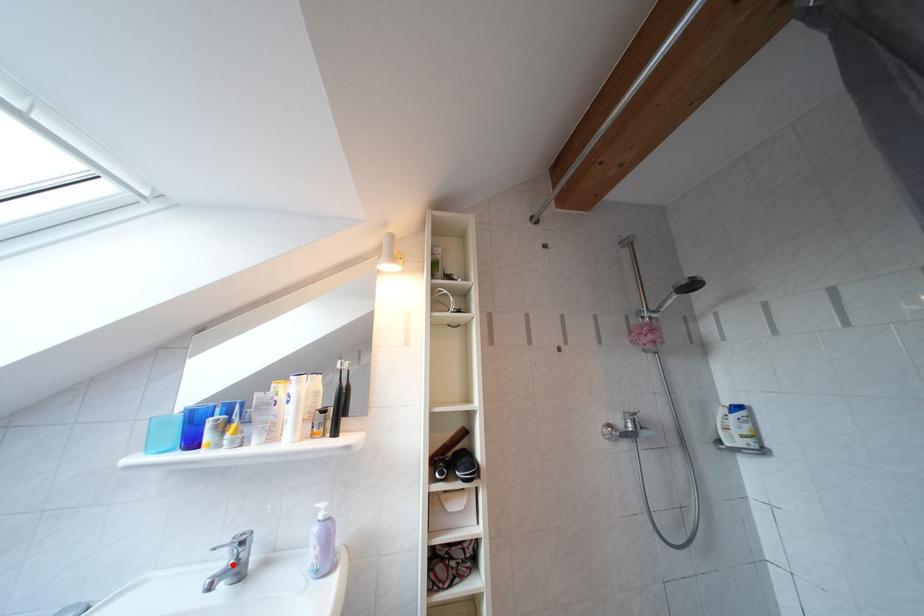
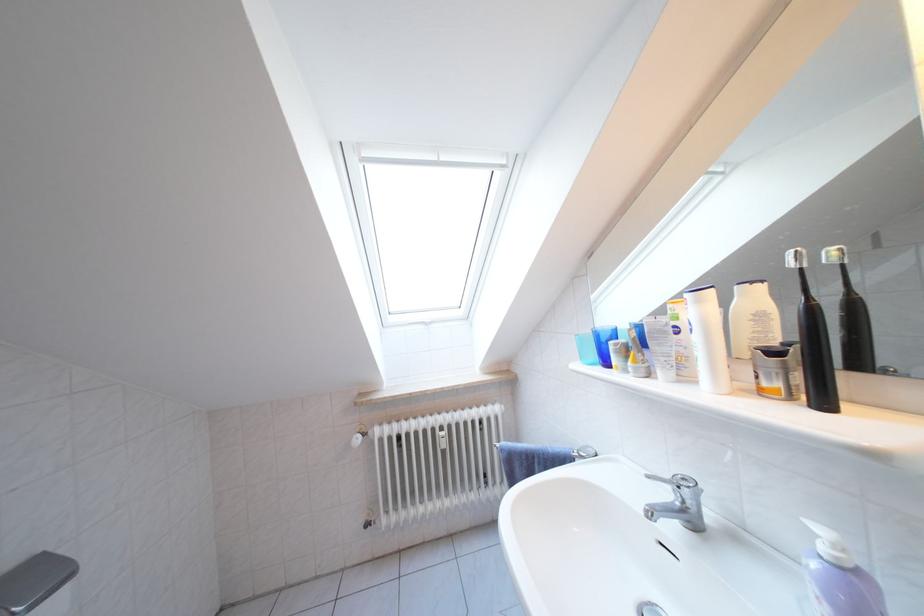
Locate, in the second image, the point that corresponds to the highlighted location in the first image.

(675, 500)